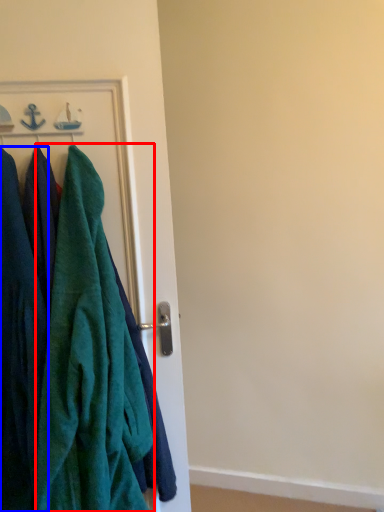
Question: Among these objects, which one is nearest to the camera, towel (highlighted by a red box) or cloak (highlighted by a blue box)?

Choices:
 (A) towel
 (B) cloak

Answer: (A)